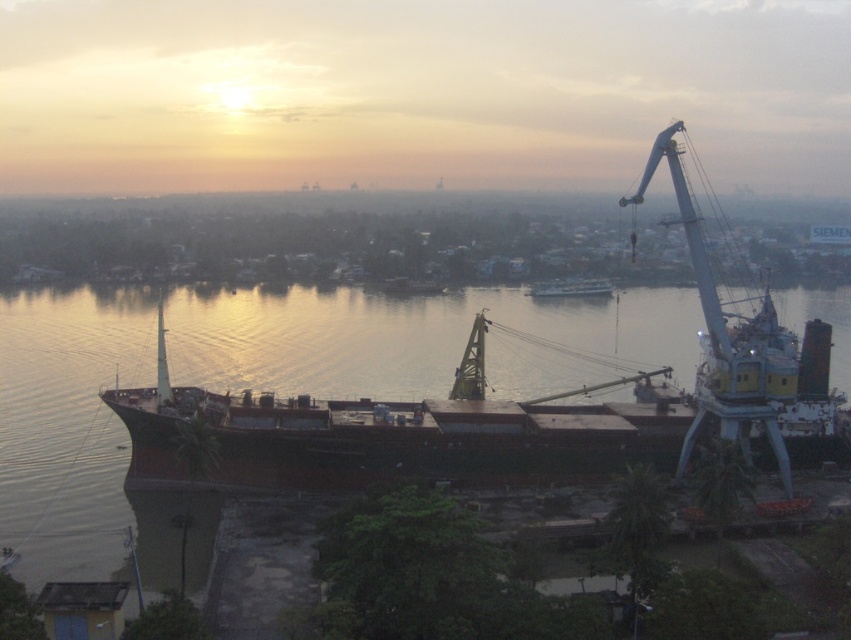
Does brown matte water at center have a larger size compared to metallic gray boat at center?

Indeed, brown matte water at center has a larger size compared to metallic gray boat at center.

Measure the distance between point (781, 296) and camera.

Point (781, 296) is 861.46 feet away from camera.

What are the coordinates of `brown matte water at center` in the screenshot? It's located at (83, 440).